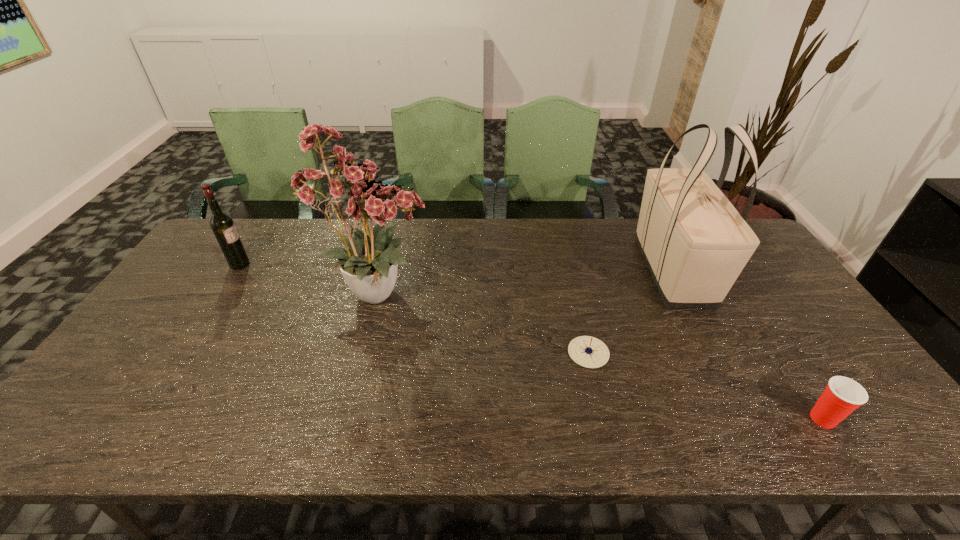
In the image, there is a desktop. Where is `vacant space at the far edge`? The height and width of the screenshot is (540, 960). vacant space at the far edge is located at coordinates (454, 256).

Locate an element on the screen. The width and height of the screenshot is (960, 540). vacant space at the near edge of the desktop is located at coordinates (669, 445).

This screenshot has height=540, width=960. Identify the location of vacant space at the left edge of the desktop. (156, 380).

In order to click on free spot between the second object from right to left and the fourth object from right to left in this screenshot , I will do `click(527, 282)`.

What are the coordinates of `vacant area that lies between the fourth object from right to left and the wine bottle` in the screenshot? It's located at (310, 279).

I want to click on free spot between the wine bottle and the second nearest object, so click(x=414, y=308).

At what (x,y) coordinates should I click in order to perform the action: click on free spot between the third shortest object and the shopping bag. Please return your answer as a coordinate pair (x, y). Image resolution: width=960 pixels, height=540 pixels. Looking at the image, I should click on coord(456,268).

Identify the location of vacant space in between the third object from left to right and the flower arrangement. Image resolution: width=960 pixels, height=540 pixels. (485, 322).

Identify the location of free space between the nearest object and the wine bottle. (532, 342).

You are a GUI agent. You are given a task and a screenshot of the screen. Output one action in this format:
    pyautogui.click(x=<x>, y=<y>)
    Task: Click on the vacant area between the fourth farthest object and the flower arrangement
    
    Given the screenshot: What is the action you would take?
    pyautogui.click(x=485, y=322)